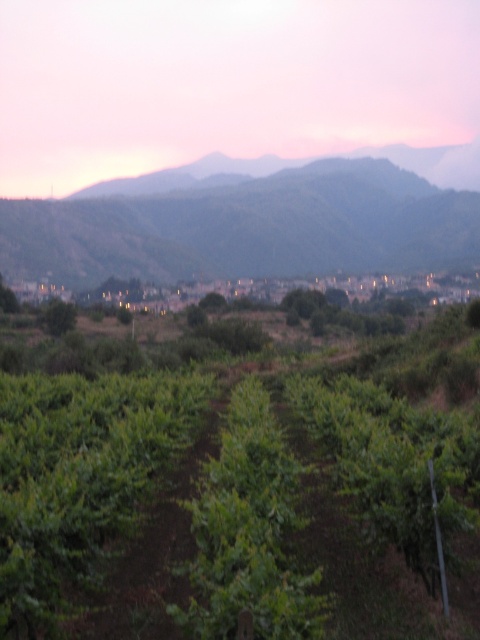
You are standing at the origin point of the image coordinate system. You want to walk towards the green leafy vineyard at center. In which direction should you go?

The green leafy vineyard at center is located at coordinate point (241, 483). Since the origin is at the bottom left corner, you should move towards the right and slightly upwards to reach it.

You are standing in the middle of the vineyard and want to walk towards the hillside. Which direction should you head to reach the green leafy hillside at center from the green leafy vineyard at center?

Since the green leafy vineyard at center is positioned on the right side of the green leafy hillside at center, you should head to the left to reach the green leafy hillside at center from the green leafy vineyard at center.